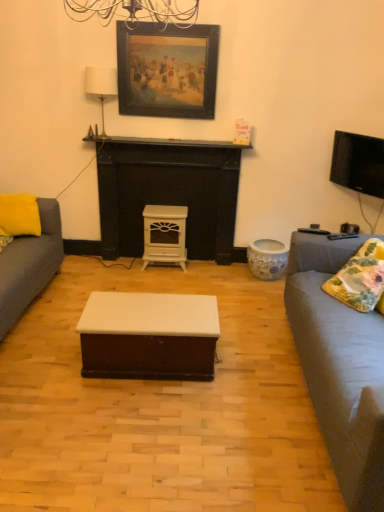
The height and width of the screenshot is (512, 384). Identify the location of free space above white matte wood coffee table at center (from a real-world perspective). (163, 307).